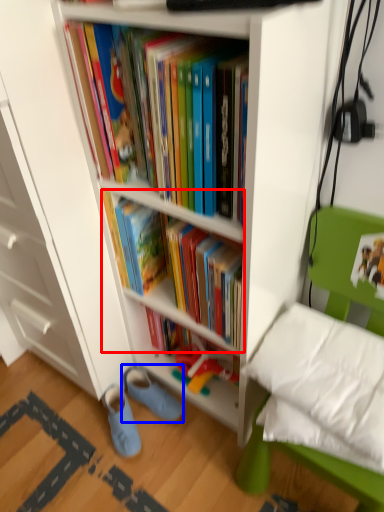
Question: Among these objects, which one is nearest to the camera, book (highlighted by a red box) or footwear (highlighted by a blue box)?

Choices:
 (A) book
 (B) footwear

Answer: (A)